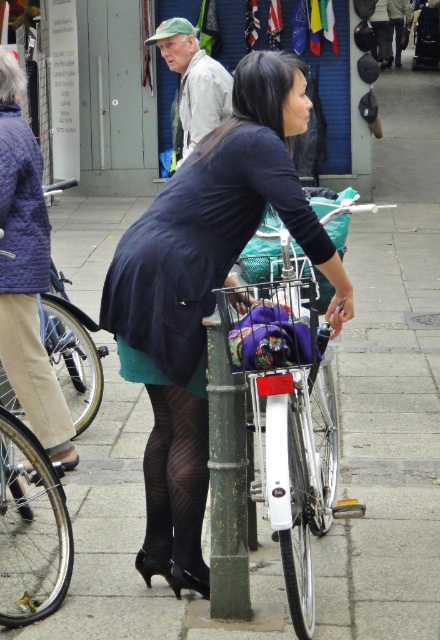
Can you confirm if matte black bicycle at center is positioned to the left of matte black dress at center?

Correct, you'll find matte black bicycle at center to the left of matte black dress at center.

Between matte black bicycle at center and matte black dress at center, which one has more height?

With more height is matte black dress at center.

Does point (413, 378) come farther from viewer compared to point (135, 380)?

Yes, it is.

I want to click on matte black bicycle at center, so click(x=387, y=436).

Consider the image. Is matte black bicycle at center wider than light beige fabric pants at lower left?

Incorrect, matte black bicycle at center's width does not surpass light beige fabric pants at lower left's.

I want to click on matte black bicycle at center, so click(387, 436).

Where is `matte black bicycle at center`? Image resolution: width=440 pixels, height=640 pixels. matte black bicycle at center is located at coordinates (387, 436).

At what (x,y) coordinates should I click in order to perform the action: click on matte black bicycle at center. Please return your answer as a coordinate pair (x, y). Looking at the image, I should click on (387, 436).

Measure the distance between point (79, 506) and camera.

5.08 meters

At what (x,y) coordinates should I click in order to perform the action: click on matte black bicycle at center. Please return your answer as a coordinate pair (x, y). Image resolution: width=440 pixels, height=640 pixels. Looking at the image, I should click on (387, 436).

Locate an element on the screen. The width and height of the screenshot is (440, 640). matte black bicycle at center is located at coordinates (387, 436).